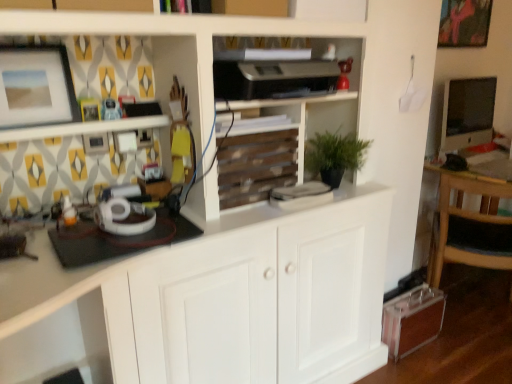
Question: Is matte pink painting at upper right, which ranks as the 1th picture frame in back-to-front order, wider or thinner than matte black monitor at right?

Choices:
 (A) wide
 (B) thin

Answer: (B)

Question: Is point (481, 1) closer or farther from the camera than point (458, 110)?

Choices:
 (A) farther
 (B) closer

Answer: (A)

Question: Which object is positioned farthest from the matte pink painting at upper right, the 2th picture frame viewed from the left?

Choices:
 (A) matte white picture frame at upper left, which is the 1th picture frame from left to right
 (B) wooden chair at right
 (C) wooden slats at center
 (D) matte black monitor at right

Answer: (A)

Question: Which is nearer to the matte white picture frame at upper left, arranged as the first picture frame when viewed from the front?

Choices:
 (A) matte black monitor at right
 (B) matte pink painting at upper right, which appears as the 2th picture frame when viewed from the front
 (C) wooden chair at right
 (D) wooden slats at center

Answer: (D)